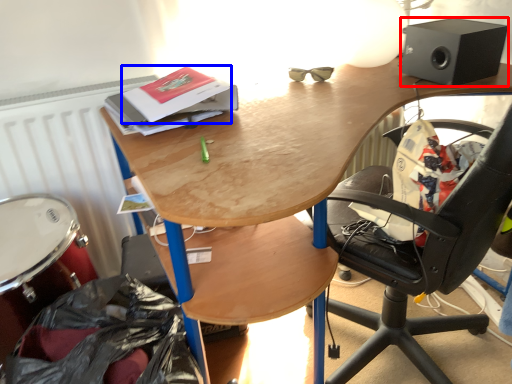
Question: Among these objects, which one is nearest to the camera, loudspeaker (highlighted by a red box) or paperback book (highlighted by a blue box)?

Choices:
 (A) loudspeaker
 (B) paperback book

Answer: (B)